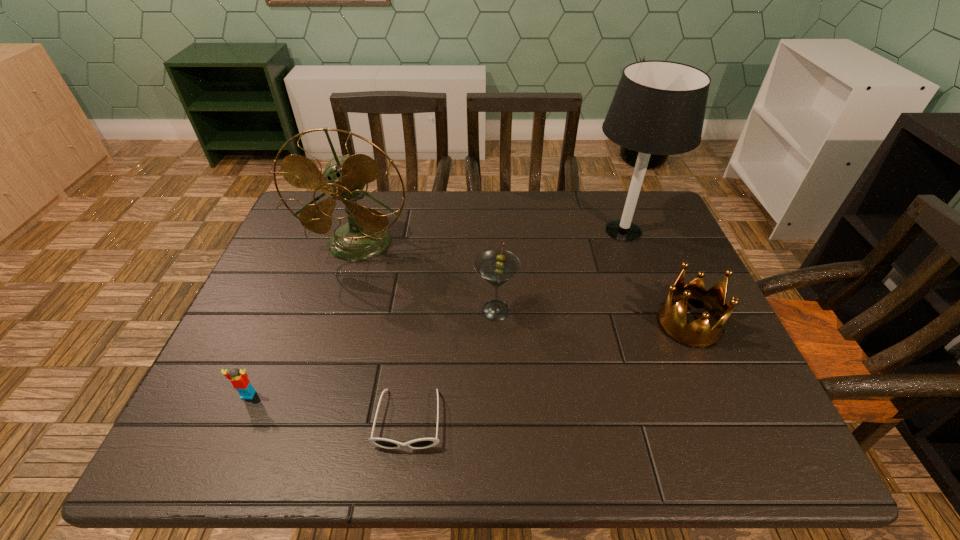
This screenshot has width=960, height=540. Identify the location of object that is at the far right corner. (658, 108).

In the image, there is a desktop. Where is `vacant space at the far edge`? vacant space at the far edge is located at coordinates (580, 219).

Identify the location of free location at the near edge of the desktop. This screenshot has width=960, height=540. pos(571,428).

Where is `vacant space at the left edge`? This screenshot has width=960, height=540. vacant space at the left edge is located at coordinates (x=279, y=378).

Image resolution: width=960 pixels, height=540 pixels. In the image, there is a desktop. Find the location of `vacant space at the right edge`. vacant space at the right edge is located at coordinates (678, 255).

The image size is (960, 540). Identify the location of vacant region at the far left corner of the desktop. (289, 237).

Identify the location of vacant space at the near right corner of the desktop. The height and width of the screenshot is (540, 960). [746, 458].

The height and width of the screenshot is (540, 960). In order to click on empty space that is in between the fourth tallest object and the martini in this screenshot , I will do [x=592, y=317].

This screenshot has width=960, height=540. What are the coordinates of `free space that is in between the crown and the tallest object` in the screenshot? It's located at (657, 277).

Where is `empty space between the Lego and the table lamp`? empty space between the Lego and the table lamp is located at coordinates (436, 313).